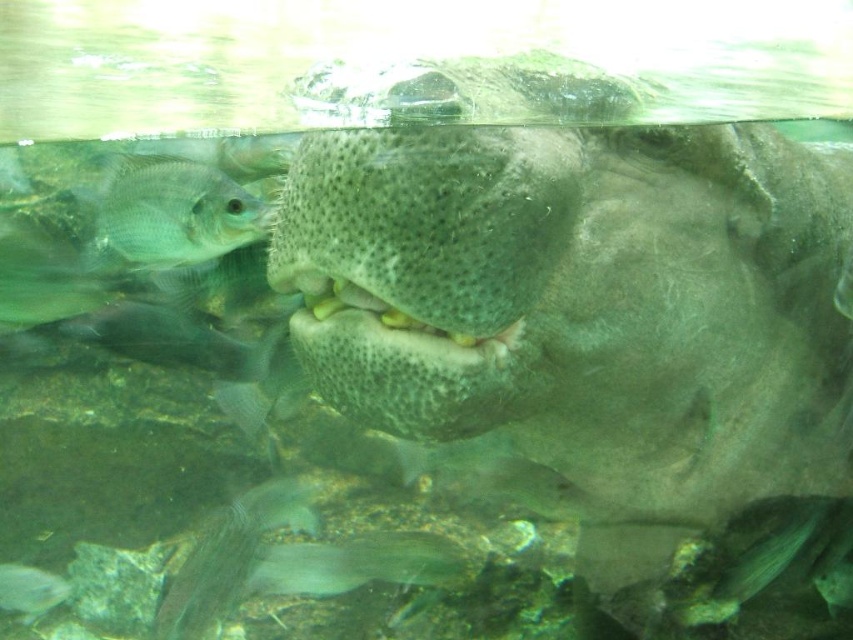
You are a marine biologist observing this underwater scene. You notice a point marked at coordinates (169,214). What object is located at this point?

The point at coordinates (169,214) marks the green matte fish at upper left.

You are a marine biologist observing underwater. You need to collect a sample from the spongy greenish mouth at center. Your tool has a maximum reach of 1.5 meters. Can you reach it?

The distance of spongy greenish mouth at center from viewer is 1.49 meters, so yes, the tool can reach it since it is within the 1.5 meters maximum reach.